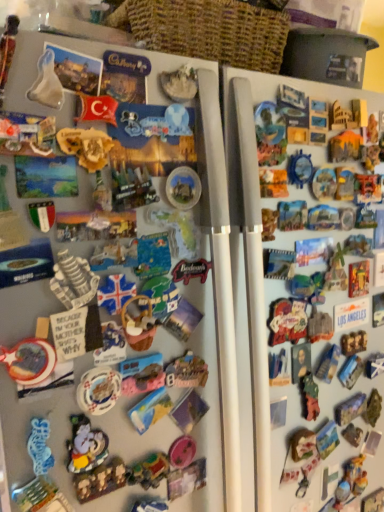
This screenshot has width=384, height=512. Find the location of `matte plastic toy at center, marked as the second toy in a bottom-to-top arrangement`. matte plastic toy at center, marked as the second toy in a bottom-to-top arrangement is located at coordinates (149, 471).

At what (x,y) coordinates should I click in order to perform the action: click on wooden bear at center, which ranks as the fifth toy in front-to-back order. Please return your answer as a coordinate pair (x, y). Looking at the image, I should click on (100, 480).

Locate an element on the screen. Image resolution: width=384 pixels, height=512 pixels. matte plastic magnet at upper left, which appears as the first toy when viewed from the left is located at coordinates (27, 134).

I want to click on green matte toy at right, the second toy from the back, so click(x=309, y=396).

The height and width of the screenshot is (512, 384). What do you see at coordinates (309, 396) in the screenshot?
I see `green matte toy at right, acting as the 9th toy starting from the left` at bounding box center [309, 396].

Identify the location of white marble statue at center, positioned as the first toy in top-to-bottom order. The image size is (384, 512). (179, 84).

Locate an element on the screen. Image resolution: width=384 pixels, height=512 pixels. matte plastic toy at center, the 3th toy positioned from the back is located at coordinates (149, 471).

Does matte plastic toy at center, positioned as the 9th toy in top-to-bottom order, have a lesser height compared to matte plastic button at right?

Yes.

In the scene shown: Is matte plastic toy at center, acting as the fourth toy starting from the right, in front of matte plastic button at right?

That is True.

Does matte plastic toy at center, placed as the seventh toy when sorted from left to right, have a lesser width compared to matte plastic button at right?

Incorrect, the width of matte plastic toy at center, placed as the seventh toy when sorted from left to right, is not less than that of matte plastic button at right.

How much distance is there between matte plastic toy at center, the 3th toy positioned from the back, and matte plastic button at right?

→ A distance of 19.68 inches exists between matte plastic toy at center, the 3th toy positioned from the back, and matte plastic button at right.

Considering the positions of point (102, 487) and point (81, 432), is point (102, 487) closer or farther from the camera than point (81, 432)?

Point (102, 487) is farther from the camera than point (81, 432).

Can you confirm if wooden bear at center, arranged as the 5th toy when viewed from the left, is wider than plush toy at center, the fifth toy positioned from the bottom?

Yes.

From a real-world perspective, is wooden bear at center, which is the sixth toy from back to front, physically located above or below plush toy at center, the sixth toy positioned from the top?

wooden bear at center, which is the sixth toy from back to front, is situated lower than plush toy at center, the sixth toy positioned from the top, in the real world.

Locate an element on the screen. This screenshot has width=384, height=512. the 2nd toy in front of the wooden bear at center, which is the sixth toy from back to front, counting from the anchor's position is located at coordinates (85, 445).

Is plush toy at center, which is counted as the second toy, starting from the left, turned away from matte plastic magnet at upper left, the 10th toy in the back-to-front sequence?

No, matte plastic magnet at upper left, the 10th toy in the back-to-front sequence, is not at the back of plush toy at center, which is counted as the second toy, starting from the left.

From a real-world perspective, does plush toy at center, placed as the 9th toy when sorted from right to left, stand above matte plastic magnet at upper left, which is the first toy in front-to-back order?

No.

From the image's perspective, which toy is the 4th one above the plush toy at center, the 8th toy from the back? Please provide its 2D coordinates.

[(27, 134)]

Which point is more forward, (x=83, y=435) or (x=39, y=134)?

The point (x=39, y=134) is closer to the camera.

Is wooden bear at center, which is the sixth toy from right to left, at the right side of white glossy plate at lower left, which is the 7th toy in right-to-left order?

Yes, wooden bear at center, which is the sixth toy from right to left, is to the right of white glossy plate at lower left, which is the 7th toy in right-to-left order.

Is point (103, 479) positioned before point (93, 398)?

No, it is not.

From a real-world perspective, is wooden bear at center, arranged as the 5th toy when viewed from the left, on white glossy plate at lower left, the seventh toy when ordered from back to front?

No, from a real-world perspective, wooden bear at center, arranged as the 5th toy when viewed from the left, is not on top of white glossy plate at lower left, the seventh toy when ordered from back to front.

Is white glossy plate at lower left, the 4th toy viewed from the left, at the back of green matte toy at right, marked as the 4th toy in a bottom-to-top arrangement?

No, green matte toy at right, marked as the 4th toy in a bottom-to-top arrangement, is not facing away from white glossy plate at lower left, the 4th toy viewed from the left.

Would you say green matte toy at right, which appears as the 9th toy when viewed from the front, is outside white glossy plate at lower left, which is the 7th toy in right-to-left order?

Indeed, green matte toy at right, which appears as the 9th toy when viewed from the front, is completely outside white glossy plate at lower left, which is the 7th toy in right-to-left order.

Does green matte toy at right, placed as the 7th toy when sorted from top to bottom, have a larger size compared to white glossy plate at lower left, which ranks as the 4th toy in front-to-back order?

Indeed, green matte toy at right, placed as the 7th toy when sorted from top to bottom, has a larger size compared to white glossy plate at lower left, which ranks as the 4th toy in front-to-back order.

Image resolution: width=384 pixels, height=512 pixels. I want to click on the 5th toy to the left of the green matte toy at right, marked as the 4th toy in a bottom-to-top arrangement, counting from the anchor's position, so pyautogui.click(x=98, y=390).

This screenshot has width=384, height=512. Find the location of `the 1st toy in front of the white marble statue at center, positioned as the first toy in top-to-bottom order, starting your count from the anchor`. the 1st toy in front of the white marble statue at center, positioned as the first toy in top-to-bottom order, starting your count from the anchor is located at coordinates (100, 480).

Which object is positioned more to the right, wooden bear at center, which is the sixth toy from right to left, or white marble statue at center, which ranks as the 5th toy in back-to-front order?

Positioned to the right is white marble statue at center, which ranks as the 5th toy in back-to-front order.

Measure the distance from woven brown basket at upper center to translucent plastic toy at center, which is the 7th toy from front to back.

woven brown basket at upper center is 24.62 inches away from translucent plastic toy at center, which is the 7th toy from front to back.

Is woven brown basket at upper center turned away from translucent plastic toy at center, placed as the sixth toy when sorted from left to right?

No, translucent plastic toy at center, placed as the sixth toy when sorted from left to right, is not at the back of woven brown basket at upper center.

Between point (196, 53) and point (140, 424), which one is positioned behind?

The point (196, 53) is behind.

From a real-world perspective, relative to translucent plastic toy at center, placed as the sixth toy when sorted from left to right, is woven brown basket at upper center vertically above or below?

From a real-world perspective, woven brown basket at upper center is physically above translucent plastic toy at center, placed as the sixth toy when sorted from left to right.

There is a matte plastic button at right. Identify the location of the 6th toy below it (from a real-world perspective). Image resolution: width=384 pixels, height=512 pixels. (149, 471).

Where is `the 3rd toy counting from the right side of the plush toy at center, placed as the 9th toy when sorted from right to left`? the 3rd toy counting from the right side of the plush toy at center, placed as the 9th toy when sorted from right to left is located at coordinates (100, 480).

From the image, which object appears to be farther from translucent plastic toy at center, which is the sixth toy from bottom to top, green matte toy at right, which appears as the 9th toy when viewed from the front, or wooden toy horse at lower right, which is the 10th toy from left to right?

The object further to translucent plastic toy at center, which is the sixth toy from bottom to top, is wooden toy horse at lower right, which is the 10th toy from left to right.

Estimate the real-world distances between objects in this image. Which object is further from wooden bear at center, which appears as the 3th toy when ordered from the bottom, wooden toy horse at lower right, which is the 10th toy from left to right, or green matte toy at right, which appears as the 9th toy when viewed from the front?

wooden toy horse at lower right, which is the 10th toy from left to right, is further to wooden bear at center, which appears as the 3th toy when ordered from the bottom.

Estimate the real-world distances between objects in this image. Which object is further from matte plastic button at right, green matte toy at right, placed as the 7th toy when sorted from top to bottom, or matte yellow map at center, which is the 2th toy in front-to-back order?

matte yellow map at center, which is the 2th toy in front-to-back order.

Considering their positions, is white glossy plate at lower left, the fourth toy when ordered from top to bottom, positioned further to green matte toy at right, placed as the 7th toy when sorted from top to bottom, than woven brown basket at upper center?

woven brown basket at upper center lies further to green matte toy at right, placed as the 7th toy when sorted from top to bottom, than the other object.

Based on their spatial positions, is matte plastic toy at center, the 3th toy positioned from the back, or white glossy plate at lower left, arranged as the seventh toy when ordered from the bottom, closer to green matte toy at right, marked as the 4th toy in a bottom-to-top arrangement?

The object closer to green matte toy at right, marked as the 4th toy in a bottom-to-top arrangement, is matte plastic toy at center, the 3th toy positioned from the back.

Which object lies further to the anchor point woven brown basket at upper center, wooden toy horse at lower right, which is the 10th toy from left to right, or matte yellow map at center, acting as the 8th toy starting from the right?

Based on the image, wooden toy horse at lower right, which is the 10th toy from left to right, appears to be further to woven brown basket at upper center.

Based on their spatial positions, is wooden bear at center, which appears as the 3th toy when ordered from the bottom, or green matte toy at right, placed as the 7th toy when sorted from top to bottom, further from matte plastic toy at center, acting as the fourth toy starting from the right?

green matte toy at right, placed as the 7th toy when sorted from top to bottom, lies further to matte plastic toy at center, acting as the fourth toy starting from the right, than the other object.

Based on their spatial positions, is wooden toy horse at lower right, arranged as the first toy when viewed from the back, or matte yellow map at center, the third toy when ordered from top to bottom, closer to plush toy at center, which is counted as the second toy, starting from the left?

Based on the image, matte yellow map at center, the third toy when ordered from top to bottom, appears to be nearer to plush toy at center, which is counted as the second toy, starting from the left.

What are the coordinates of `button between woven brown basket at upper center and wooden toy horse at lower right, the 10th toy when ordered from top to bottom, in the up-down direction` in the screenshot? It's located at (351, 314).

At what (x,y) coordinates should I click in order to perform the action: click on button between white marble statue at center, which ranks as the 5th toy in back-to-front order, and translucent plastic toy at center, which ranks as the fifth toy in top-to-bottom order, in the up-down direction. Please return your answer as a coordinate pair (x, y). The width and height of the screenshot is (384, 512). Looking at the image, I should click on (351, 314).

This screenshot has height=512, width=384. What are the coordinates of `button between woven brown basket at upper center and translucent plastic toy at center, placed as the 4th toy when sorted from back to front, vertically` in the screenshot? It's located at (351, 314).

In order to click on button that lies between white marble statue at center, the third toy viewed from the right, and wooden toy horse at lower right, acting as the tenth toy starting from the front, from top to bottom in this screenshot , I will do `click(351, 314)`.